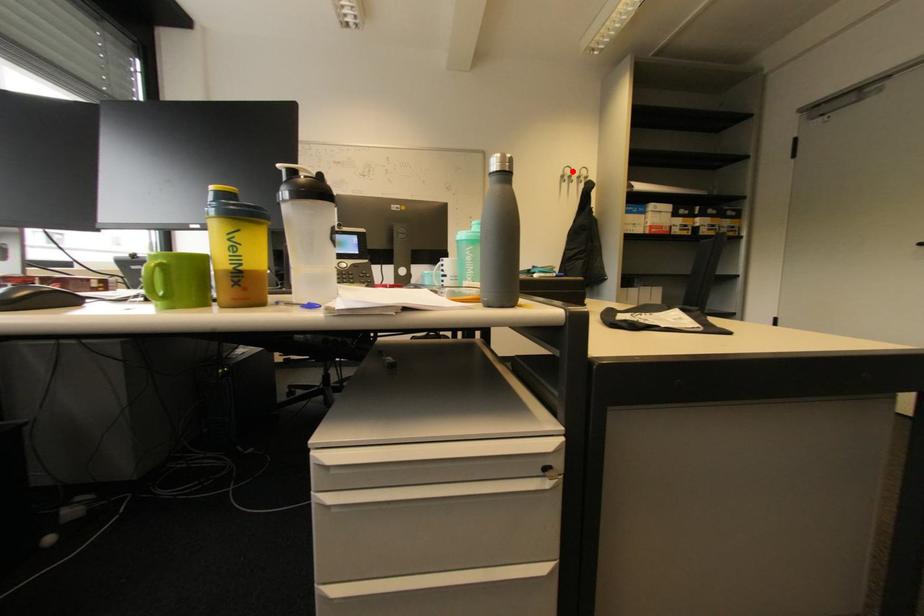
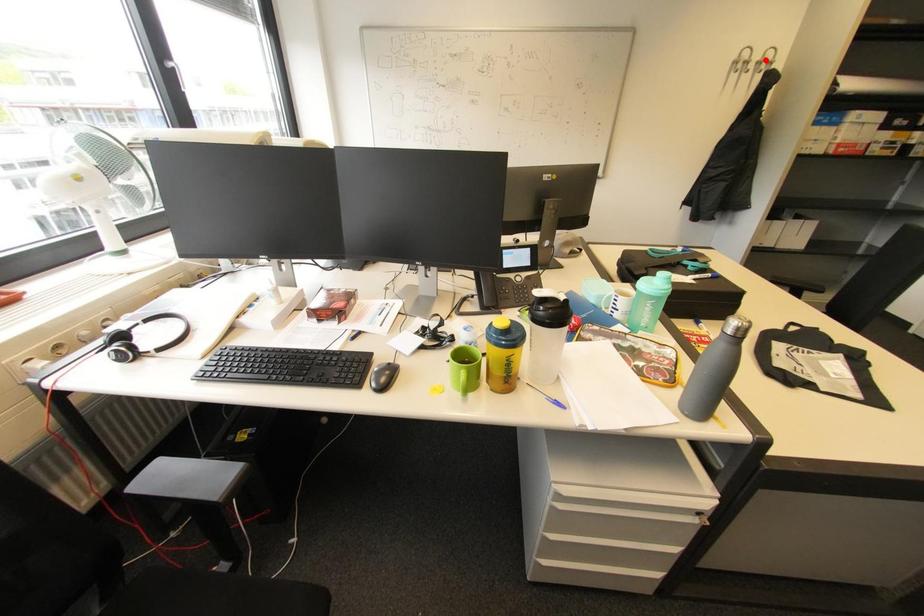
I am providing you with two images of the same scene from different viewpoints. A red point is marked on the first image and another point is marked on the second image. Do the highlighted points in image1 and image2 indicate the same real-world spot?

No